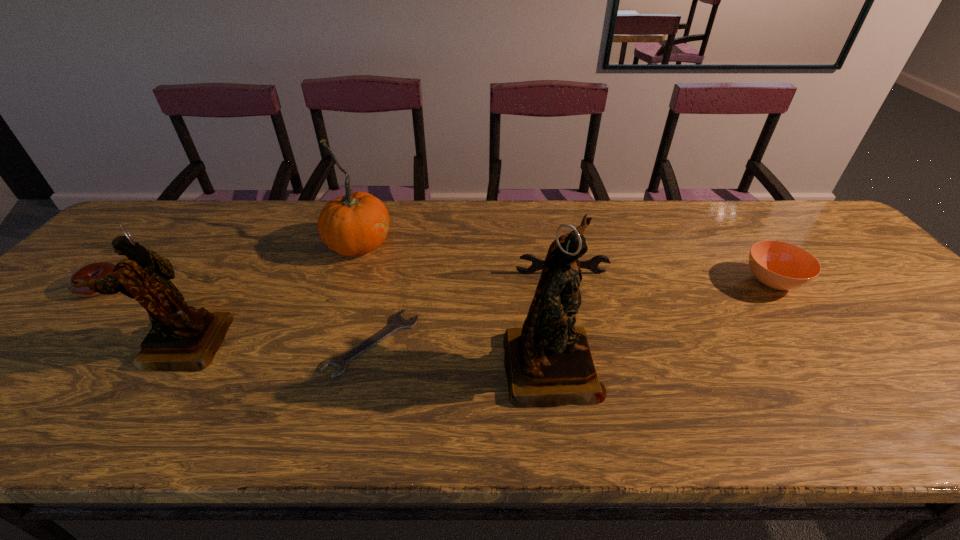
In order to click on the left figurine in this screenshot , I will do `click(182, 338)`.

Identify the location of the shorter figurine. This screenshot has width=960, height=540. (182, 338).

Where is `the right figurine`? The height and width of the screenshot is (540, 960). the right figurine is located at coordinates (548, 363).

Where is `the taller figurine`? The width and height of the screenshot is (960, 540). the taller figurine is located at coordinates (548, 363).

Identify the location of pumpkin. The width and height of the screenshot is (960, 540). pos(357,223).

Locate an element on the screen. Image resolution: width=960 pixels, height=540 pixels. soup bowl is located at coordinates (779, 265).

Find the location of a particular element. the rightmost object is located at coordinates (779, 265).

The height and width of the screenshot is (540, 960). I want to click on the third shortest object, so click(537, 264).

Locate an element on the screen. This screenshot has width=960, height=540. the farther wrench is located at coordinates 537,264.

Identify the location of the sixth tallest object. Image resolution: width=960 pixels, height=540 pixels. (100, 269).